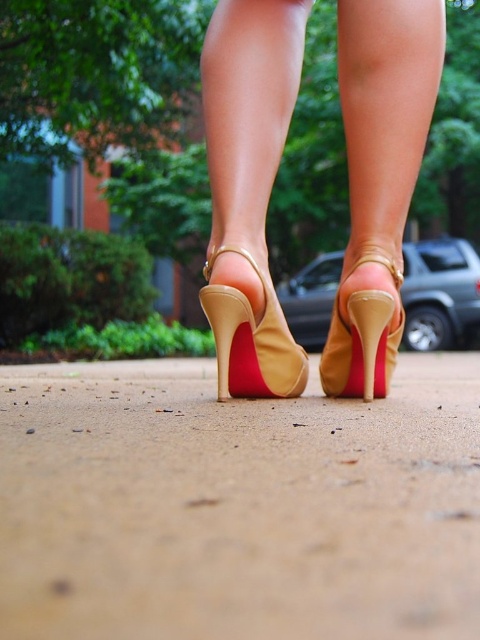
Which is behind, point (10, 600) or point (220, 369)?

The point (220, 369) is behind.

From the picture: Does sandy beige pavement at center appear under tan suede high-heeled sandal at center?

Yes.

Find the location of `sandy beige pavement at center`. sandy beige pavement at center is located at coordinates [238, 504].

Who is more forward, (420, 90) or (283, 372)?

Point (420, 90) is more forward.

Based on the photo, does satin beige high heels at center appear over tan suede high-heeled sandal at center?

Correct, satin beige high heels at center is located above tan suede high-heeled sandal at center.

The width and height of the screenshot is (480, 640). Describe the element at coordinates (249, 188) in the screenshot. I see `satin beige high heels at center` at that location.

This screenshot has width=480, height=640. What are the coordinates of `satin beige high heels at center` in the screenshot? It's located at (249, 188).

Which is below, metallic silver car at center or tan suede high-heeled sandal at center?

Positioned lower is tan suede high-heeled sandal at center.

Is metallic silver car at center positioned behind tan suede high-heeled sandal at center?

Yes, metallic silver car at center is further from the viewer.

Where is `metallic silver car at center`? The width and height of the screenshot is (480, 640). metallic silver car at center is located at coordinates (440, 292).